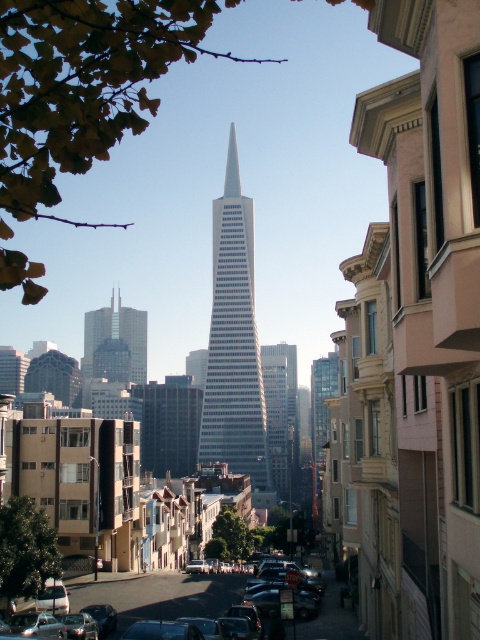
Does point (108, 593) come farther from viewer compared to point (136, 330)?

No, (108, 593) is in front of (136, 330).

Find the location of `metallic silver car at center`. metallic silver car at center is located at coordinates (159, 595).

Image resolution: width=480 pixels, height=640 pixels. I want to click on metallic silver car at center, so click(159, 595).

Does white glass skyscraper at center appear under matte glass skyscraper at center?

No.

The width and height of the screenshot is (480, 640). Identify the location of white glass skyscraper at center. (233, 340).

Between white glass skyscraper at center and metallic silver car at center, which one appears on the right side from the viewer's perspective?

From the viewer's perspective, metallic silver car at center appears more on the right side.

Can you confirm if white glass skyscraper at center is positioned to the right of metallic silver car at center?

No, white glass skyscraper at center is not to the right of metallic silver car at center.

Which is behind, point (241, 420) or point (144, 611)?

Point (241, 420)

At what (x,y) coordinates should I click in order to perform the action: click on white glass skyscraper at center. Please return your answer as a coordinate pair (x, y). This screenshot has height=640, width=480. Looking at the image, I should click on (233, 340).